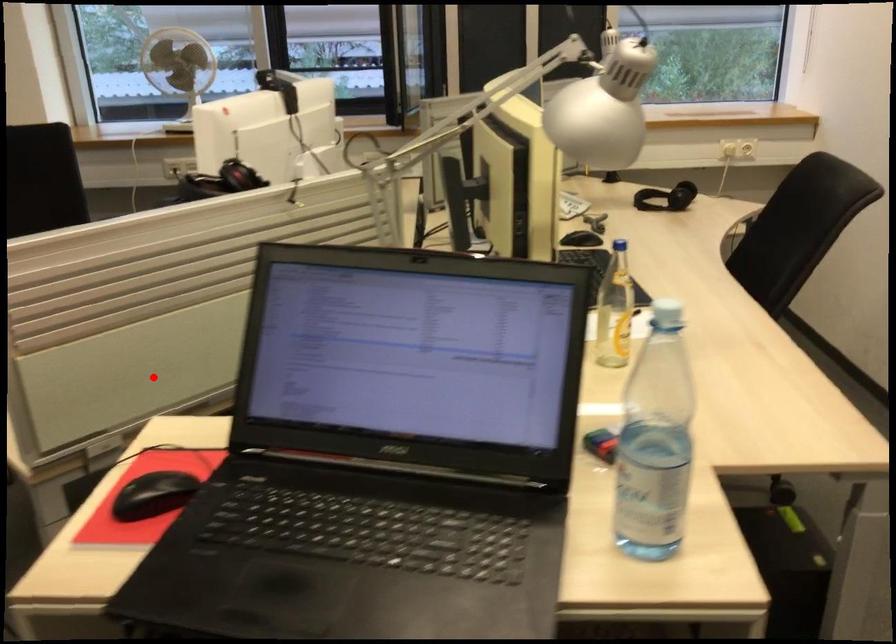
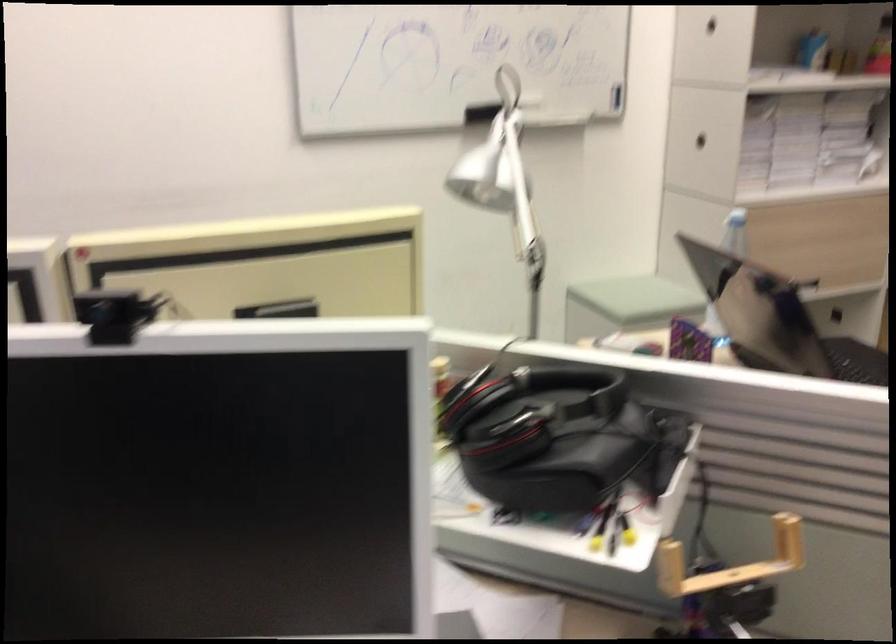
The point at the highlighted location is marked in the first image. Where is the corresponding point in the second image?

(730, 562)